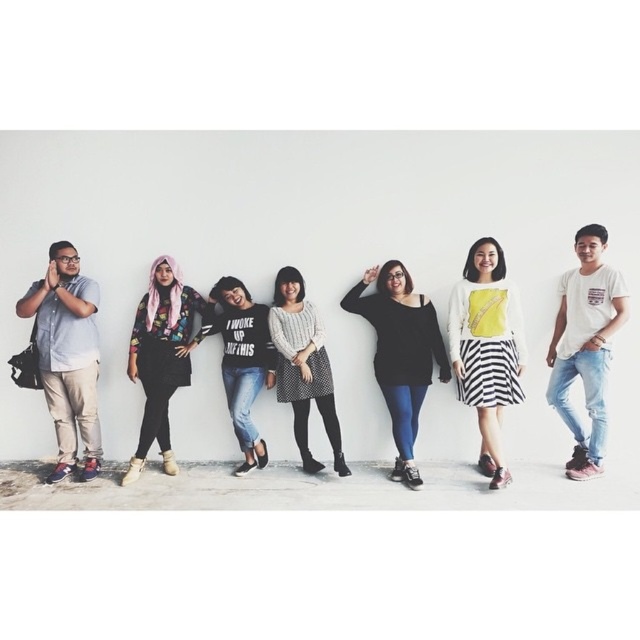
Question: Considering the real-world distances, which object is closest to the black matte sweater at center?

Choices:
 (A) white matte sweater at center
 (B) multicolored fabric hijab at center
 (C) white cotton t-shirt at right

Answer: (A)

Question: Is black matte sweater at center bigger than black cotton t-shirt at center?

Choices:
 (A) yes
 (B) no

Answer: (A)

Question: Is white cotton t-shirt at right positioned at the back of white matte sweater at center?

Choices:
 (A) no
 (B) yes

Answer: (A)

Question: Among these objects, which one is farthest from the camera?

Choices:
 (A) white cotton t-shirt at right
 (B) matte gray shirt at left

Answer: (B)

Question: Does white matte sweater at center have a larger size compared to black cotton t-shirt at center?

Choices:
 (A) yes
 (B) no

Answer: (A)

Question: Which is nearer to the knitted sweater at center?

Choices:
 (A) matte gray shirt at left
 (B) white cotton t-shirt at right

Answer: (A)